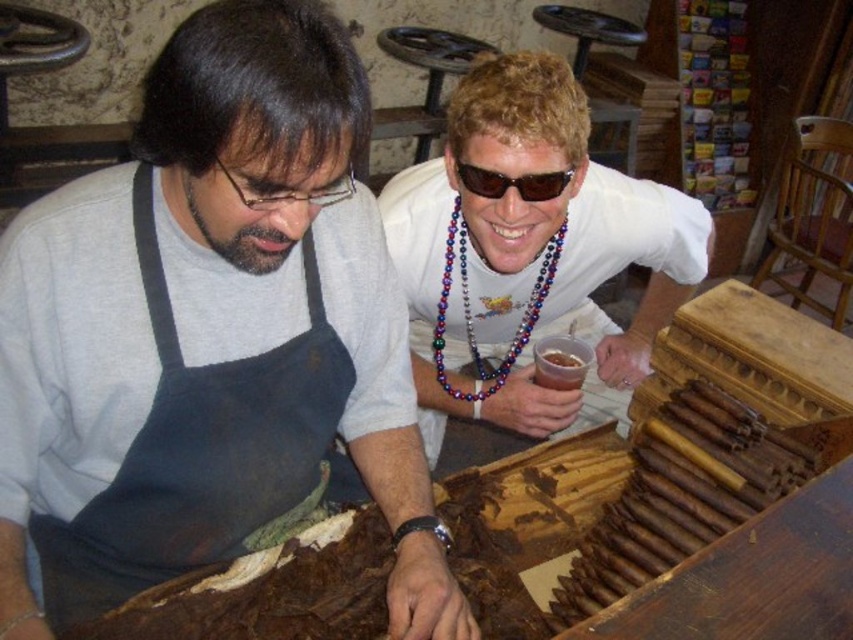
Based on the scene description, which object is wider, the matte gray apron at center or the multicolored beaded necklace at upper center?

The matte gray apron at center is wider than the multicolored beaded necklace at upper center according to the description.

You are a photographer trying to capture a closeup shot of the sunglasses at upper center. The white matte shirt at upper center is blocking your view. Can you tell if the shirt is bigger than the sunglasses?

The white matte shirt at upper center is larger in size than sunglasses at upper center, so yes, the shirt is bigger than the sunglasses and is blocking the view.